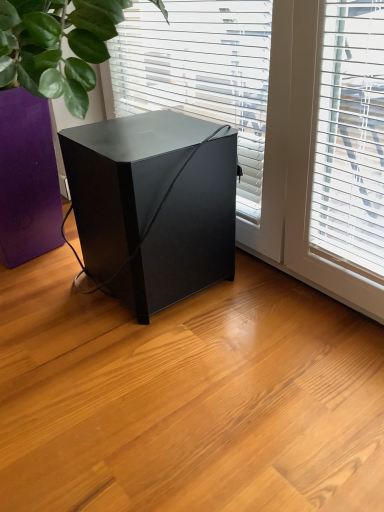
Identify the location of empty space that is to the right of matte black speaker at center. (286, 301).